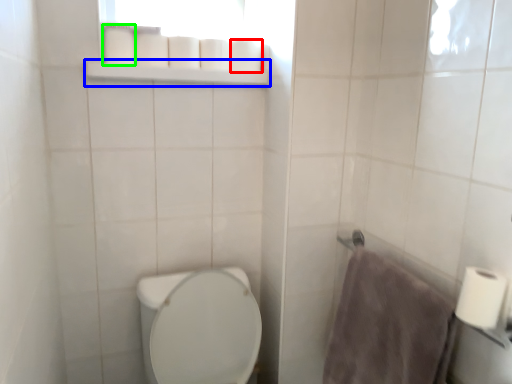
Question: Considering the real-world distances, which object is closest to toilet paper (highlighted by a red box)? balustrade (highlighted by a blue box) or toilet paper (highlighted by a green box).

Choices:
 (A) balustrade
 (B) toilet paper

Answer: (A)